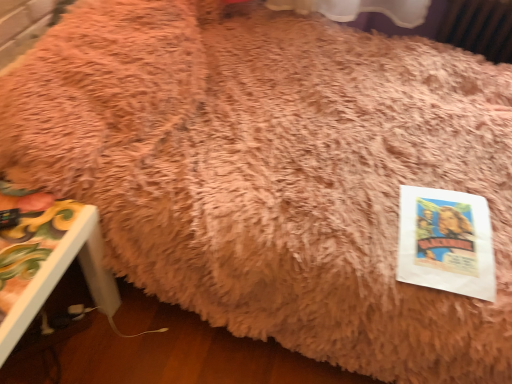
Find the location of a particular element. This screenshot has height=384, width=512. vacant space situated above white paper at lower right (from a real-world perspective) is located at coordinates (451, 221).